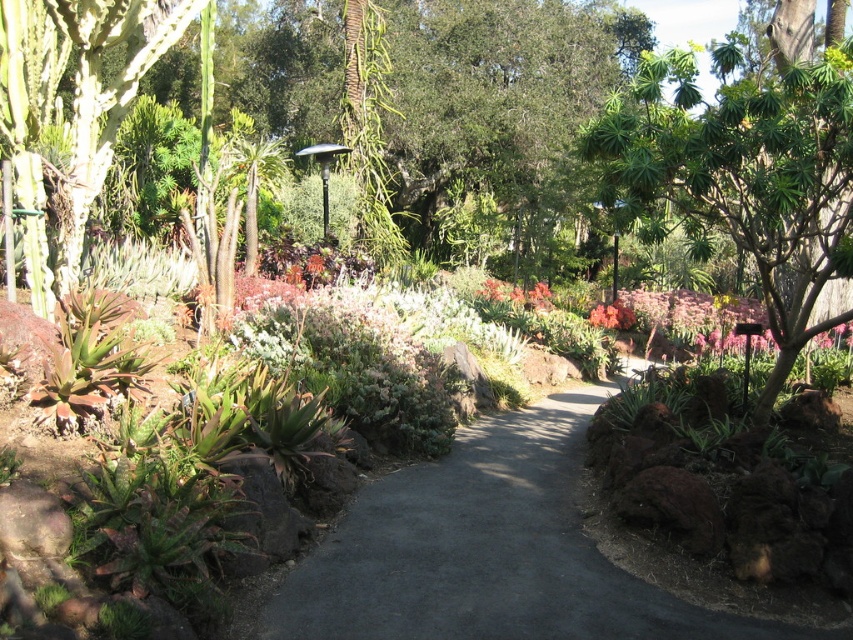
You are standing at the entrance of the garden and see the green leafy tree at upper right and the pink matte flower at center. Which object is positioned higher in the image?

The green leafy tree at upper right is located above the pink matte flower at center, so it is positioned higher in the image.

You are a gardener standing at the entrance of the garden. You need to place a new decorative stone on the dark gray asphalt at center so that it is between the asphalt and the pink matte flower at center. Is this possible?

The dark gray asphalt at center is in front of the pink matte flower at center, so placing the decorative stone between them would require placing it on the asphalt closer to the flower, which is feasible.